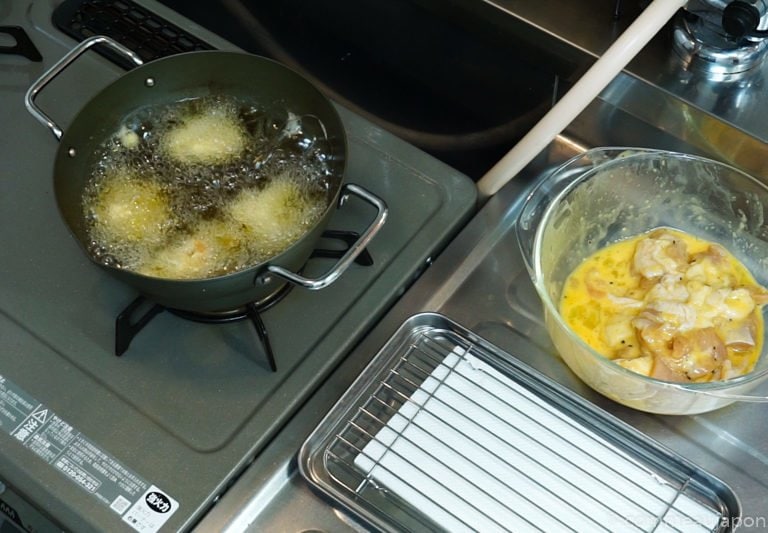
You are a GUI agent. You are given a task and a screenshot of the screen. Output one action in this format:
    pyautogui.click(x=<x>, y=<y>)
    Task: Click on the food inside black pot
    Image resolution: width=768 pixels, height=533 pixels.
    Given the screenshot: What is the action you would take?
    pyautogui.click(x=204, y=250), pyautogui.click(x=290, y=218), pyautogui.click(x=219, y=127), pyautogui.click(x=131, y=212)